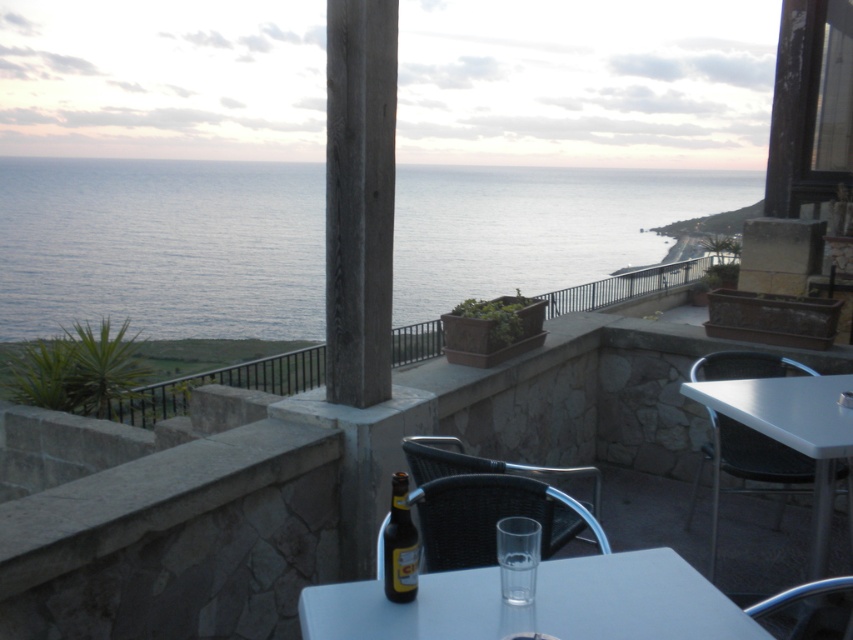
Question: Which object is positioned farthest from the smooth concrete pillar at center?

Choices:
 (A) white plastic table at center
 (B) black plastic chair at lower right
 (C) metallic silver chair at lower right

Answer: (C)

Question: Where is black plastic chair at lower right located in relation to clear glass at table center in the image?

Choices:
 (A) right
 (B) left

Answer: (A)

Question: Is black wicker chair at center to the left of black plastic chair at lower right from the viewer's perspective?

Choices:
 (A) yes
 (B) no

Answer: (A)

Question: Estimate the real-world distances between objects in this image. Which object is farther from the black wicker chair at center?

Choices:
 (A) white plastic table at center
 (B) metallic silver chair at lower right
 (C) brown glass bottle at lower center
 (D) black plastic chair at lower right

Answer: (B)

Question: Is smooth concrete pillar at center to the left of clear glass at table center from the viewer's perspective?

Choices:
 (A) no
 (B) yes

Answer: (B)

Question: Which object is the farthest from the blue water at upper left?

Choices:
 (A) clear glass at table center
 (B) black wicker chair at center
 (C) metallic silver chair at lower right

Answer: (C)